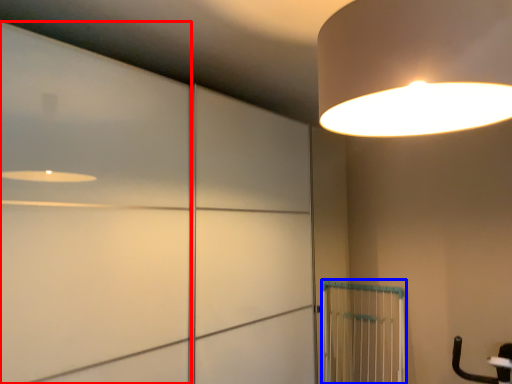
Question: Among these objects, which one is nearest to the camera, door (highlighted by a red box) or cage (highlighted by a blue box)?

Choices:
 (A) door
 (B) cage

Answer: (A)